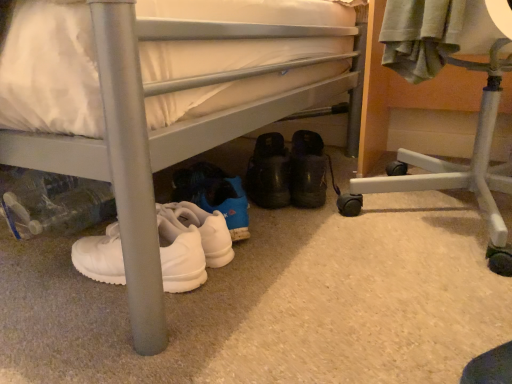
Question: Is white matte sneakers at lower left situated inside white plastic chair at lower right or outside?

Choices:
 (A) inside
 (B) outside

Answer: (B)

Question: Considering the positions of white matte sneakers at lower left and white plastic chair at lower right in the image, is white matte sneakers at lower left wider or thinner than white plastic chair at lower right?

Choices:
 (A) thin
 (B) wide

Answer: (B)

Question: Which of these objects is positioned closest to the white plastic chair at lower right?

Choices:
 (A) black suede shoes at center
 (B) white matte sneakers at lower left

Answer: (A)

Question: Based on their relative distances, which object is farther from the white plastic chair at lower right?

Choices:
 (A) white matte sneakers at lower left
 (B) black suede shoes at center

Answer: (A)